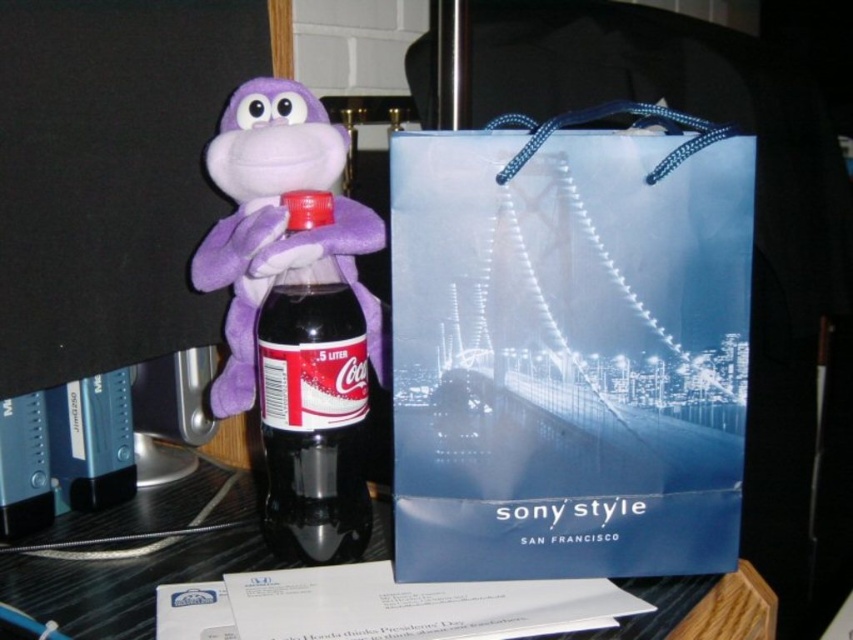
You have a small toy that is 3 inches wide. You want to place it between the blue paper bag at center and the black glossy table at center. Is there enough space for the toy to fit between them?

The blue paper bag at center and the black glossy table at center are 7.10 inches apart. Since the toy is only 3 inches wide, there is enough space for it to fit between them.

You are standing at the origin point in the image. Which of the two points, point 1 at coordinates (300, 454) or point 2 at coordinates (270, 168), is closer to you?

Point 1 at coordinates (300, 454) is closer to you because it is in front of point 2 at coordinates (270, 168).